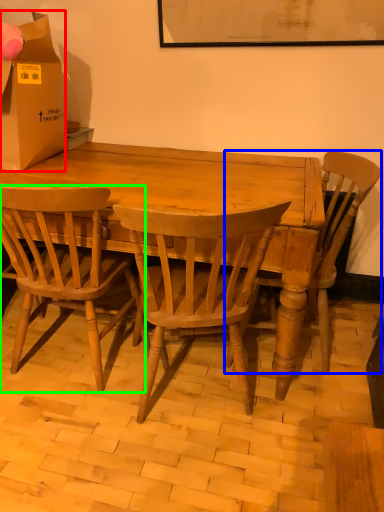
Question: Which object is positioned closest to box (highlighted by a red box)? Select from chair (highlighted by a blue box) and chair (highlighted by a green box).

Choices:
 (A) chair
 (B) chair

Answer: (B)